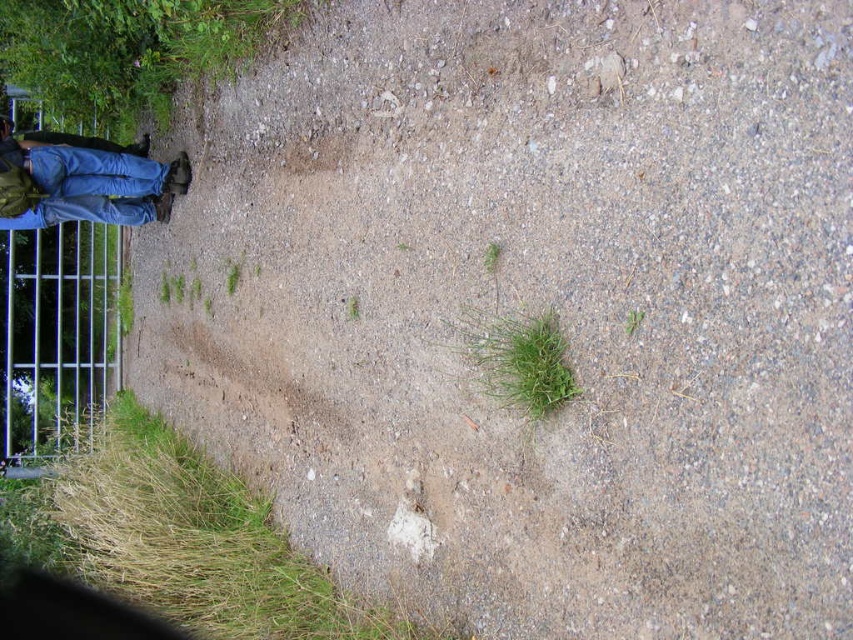
Who is positioned more to the left, green grass at lower left or blue jeans at left?

From the viewer's perspective, blue jeans at left appears more on the left side.

Is green grass at lower left wider than blue jeans at left?

Correct, the width of green grass at lower left exceeds that of blue jeans at left.

Where is `green grass at lower left`? The width and height of the screenshot is (853, 640). green grass at lower left is located at coordinates (177, 538).

At what (x,y) coordinates should I click in order to perform the action: click on green grass at lower left. Please return your answer as a coordinate pair (x, y). Looking at the image, I should click on (177, 538).

Does metallic silver fence at left appear on the left side of green leafy grass at center?

Indeed, metallic silver fence at left is positioned on the left side of green leafy grass at center.

Between metallic silver fence at left and green leafy grass at center, which one is positioned higher?

green leafy grass at center is above.

Identify the location of metallic silver fence at left. The image size is (853, 640). (54, 332).

Can you confirm if blue jeans at left is smaller than green leafy grass at center?

Actually, blue jeans at left might be larger than green leafy grass at center.

Which is more to the left, blue jeans at left or green leafy grass at center?

blue jeans at left is more to the left.

Between point (28, 189) and point (515, 328), which one is positioned behind?

The point (28, 189) is more distant.

Identify the location of blue jeans at left. (86, 182).